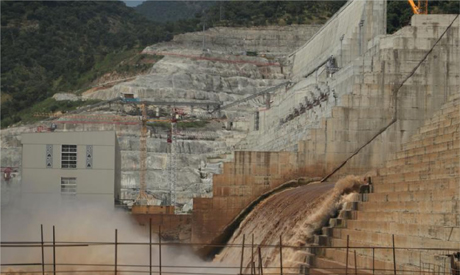
Where is `windows`? windows is located at coordinates (67, 148), (71, 156), (68, 162), (71, 179), (69, 189), (66, 195).